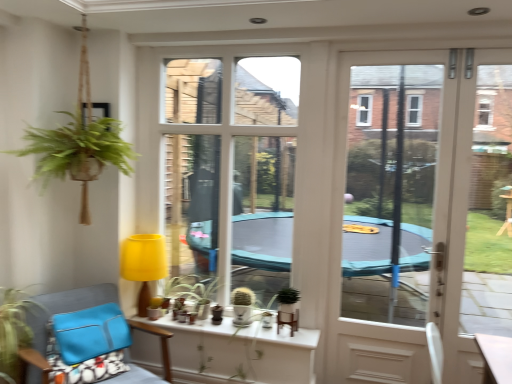
Identify the location of vacant point above white ceramic pots at center (from a real-world perspective). The width and height of the screenshot is (512, 384). (221, 317).